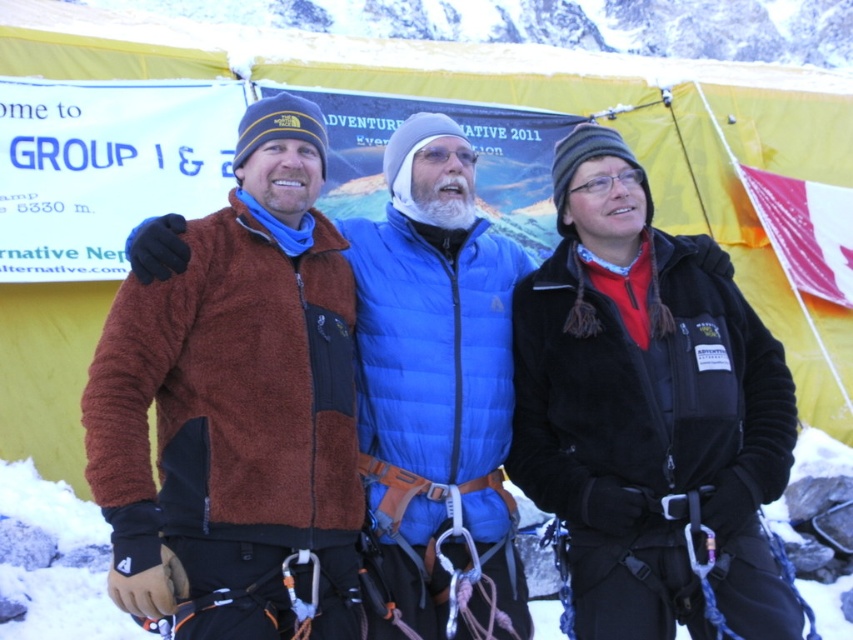
Is the position of brown fleece jacket at center more distant than that of black fleece jacket at center?

That is True.

Does brown fleece jacket at center have a greater height compared to black fleece jacket at center?

Yes.

Identify the location of brown fleece jacket at center. The image size is (853, 640). (647, 412).

The image size is (853, 640). In order to click on brown fleece jacket at center in this screenshot , I will do `click(647, 412)`.

Which is below, brown fleece jacket at center or blue down vest at center?

brown fleece jacket at center is below.

Measure the distance between point (x=654, y=609) and camera.

Point (x=654, y=609) and camera are 20.09 meters apart from each other.

Describe the element at coordinates (647, 412) in the screenshot. The image size is (853, 640). I see `brown fleece jacket at center` at that location.

Locate an element on the screen. The height and width of the screenshot is (640, 853). brown fleece jacket at center is located at coordinates (647, 412).

Between black fleece jacket at center and blue down vest at center, which one appears on the left side from the viewer's perspective?

blue down vest at center

Can you confirm if black fleece jacket at center is wider than blue down vest at center?

Yes.

Who is more forward, (624, 545) or (358, 362)?

Point (624, 545)

Identify the location of black fleece jacket at center. This screenshot has height=640, width=853. (650, 413).